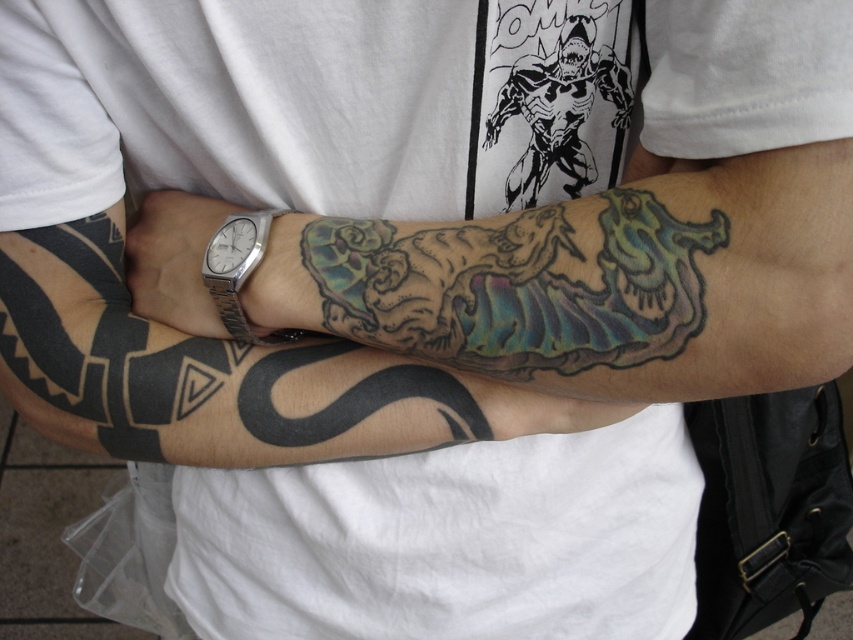
Question: Which object is closer to the camera taking this photo?

Choices:
 (A) silver metallic watch at center
 (B) multicolored ink dragon at center
 (C) silver metallic watch at left

Answer: (B)

Question: Considering the real-world distances, which object is farthest from the multicolored ink dragon at center?

Choices:
 (A) silver metallic watch at left
 (B) silver metallic watch at center

Answer: (B)

Question: Is multicolored ink dragon at center to the left of silver metallic watch at center from the viewer's perspective?

Choices:
 (A) yes
 (B) no

Answer: (B)

Question: Does multicolored ink dragon at center appear under silver metallic watch at left?

Choices:
 (A) no
 (B) yes

Answer: (B)

Question: Which object is the closest to the multicolored ink dragon at center?

Choices:
 (A) silver metallic watch at left
 (B) silver metallic watch at center

Answer: (A)

Question: In this image, where is multicolored ink dragon at center located relative to silver metallic watch at left?

Choices:
 (A) left
 (B) right

Answer: (B)